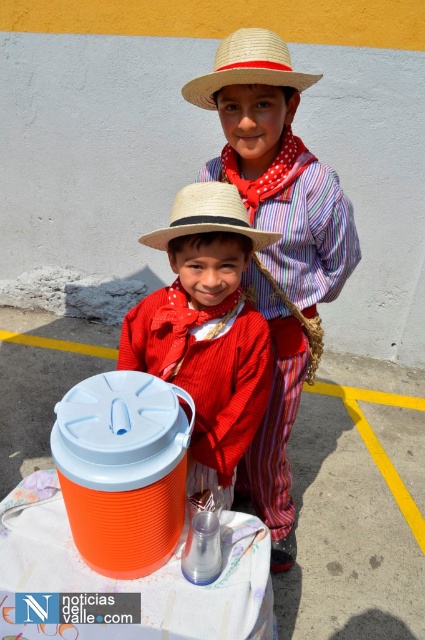
Question: Is matte plastic bucket at center smaller than matte straw hat at center?

Choices:
 (A) yes
 (B) no

Answer: (B)

Question: Which object is the farthest from the strawhat at upper center?

Choices:
 (A) strawhat at center
 (B) matte straw hat at center

Answer: (B)

Question: Among these objects, which one is farthest from the camera?

Choices:
 (A) matte straw hat at center
 (B) strawhat at upper center
 (C) matte plastic bucket at center
 (D) strawhat at center

Answer: (C)

Question: Among these points, which one is nearest to the camera?

Choices:
 (A) (197, 476)
 (B) (170, 212)

Answer: (A)

Question: Can you confirm if matte straw hat at center is thinner than strawhat at center?

Choices:
 (A) no
 (B) yes

Answer: (A)

Question: Considering the relative positions of matte plastic bucket at center and strawhat at center in the image provided, where is matte plastic bucket at center located with respect to strawhat at center?

Choices:
 (A) left
 (B) right

Answer: (B)